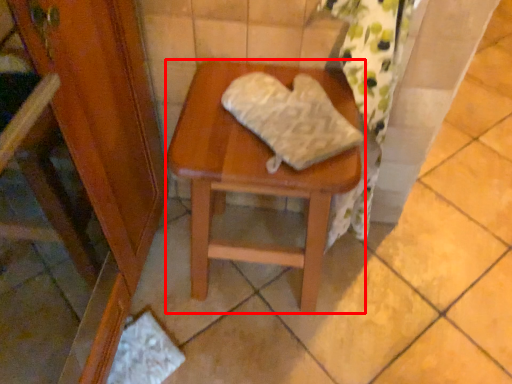
Question: Observing the image, what is the correct spatial positioning of stool (annotated by the red box) in reference to material?

Choices:
 (A) right
 (B) left

Answer: (B)